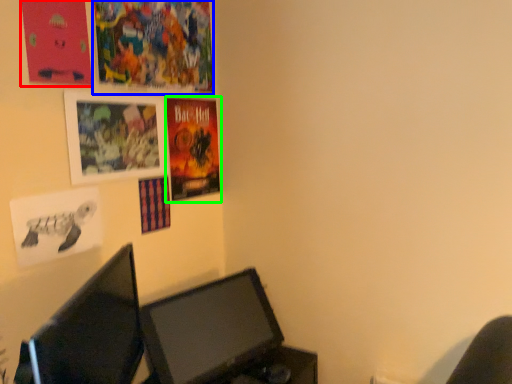
Question: Considering the real-world distances, which object is farthest from poster page (highlighted by a red box)? poster page (highlighted by a blue box) or poster (highlighted by a green box)?

Choices:
 (A) poster page
 (B) poster

Answer: (B)